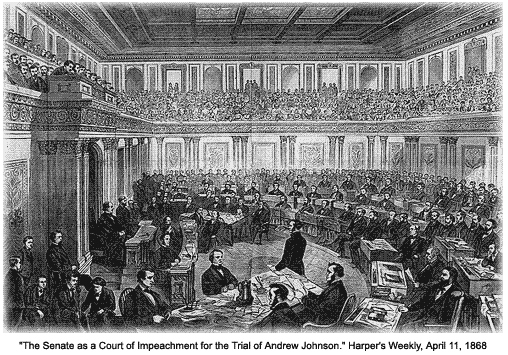
The width and height of the screenshot is (508, 355). I want to click on mirror, so click(x=185, y=75).